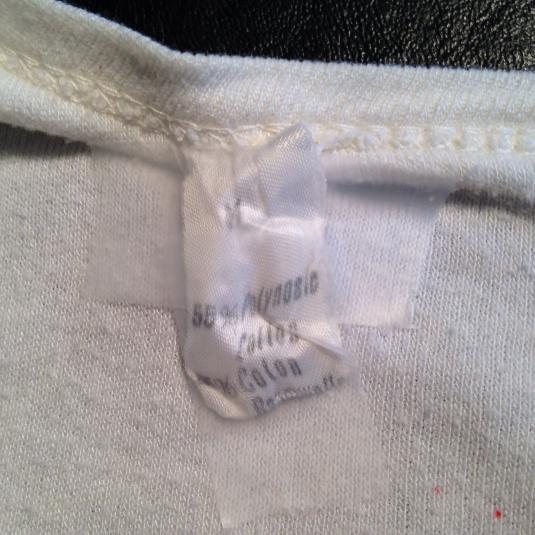
Identify the location of stains. The width and height of the screenshot is (535, 535). (496, 515), (435, 492).